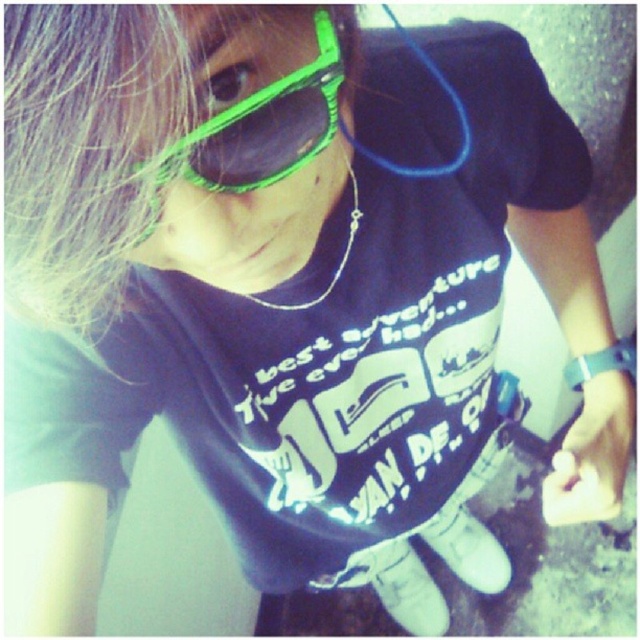
Question: Is blonde hair at upper left below green plastic goggles at upper center?

Choices:
 (A) no
 (B) yes

Answer: (B)

Question: Is blonde hair at upper left thinner than green plastic goggles at upper center?

Choices:
 (A) no
 (B) yes

Answer: (A)

Question: Which object appears closest to the camera in this image?

Choices:
 (A) green plastic goggles at upper center
 (B) blonde hair at upper left

Answer: (B)

Question: Does blonde hair at upper left appear under green plastic goggles at upper center?

Choices:
 (A) no
 (B) yes

Answer: (B)